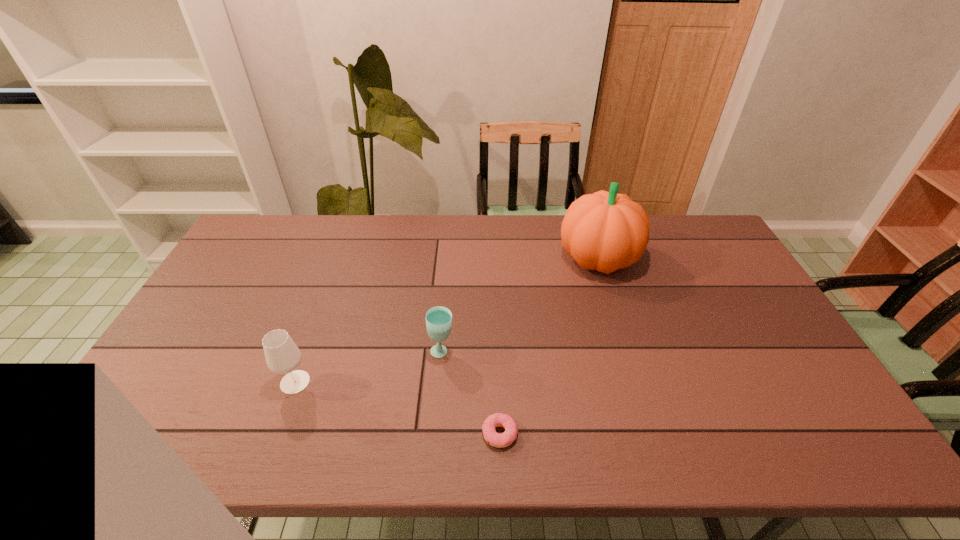
Where is `blank space located on the right of the farther glass`? This screenshot has height=540, width=960. blank space located on the right of the farther glass is located at coordinates (564, 352).

Find the location of a particular element. free location located on the back of the shortest object is located at coordinates coord(495,300).

I want to click on object located in the far edge section of the desktop, so click(604, 231).

Image resolution: width=960 pixels, height=540 pixels. I want to click on object present at the near edge, so click(506, 438).

You are a GUI agent. You are given a task and a screenshot of the screen. Output one action in this format:
    pyautogui.click(x=<x>, y=<y>)
    Task: Click on the vacant space at the far edge of the desktop
    This screenshot has width=960, height=540.
    Given the screenshot: What is the action you would take?
    pyautogui.click(x=549, y=224)

Identify the location of free point at the near edge. Image resolution: width=960 pixels, height=540 pixels. (176, 449).

Find the location of `free spot at the right edge of the desktop`. free spot at the right edge of the desktop is located at coordinates (744, 355).

Where is `vacant space at the far left corner`? vacant space at the far left corner is located at coordinates (253, 238).

Image resolution: width=960 pixels, height=540 pixels. In the image, there is a desktop. In order to click on vacant space at the near left corner in this screenshot , I will do `click(144, 426)`.

The width and height of the screenshot is (960, 540). In the image, there is a desktop. Identify the location of blank space at the far right corner. (687, 230).